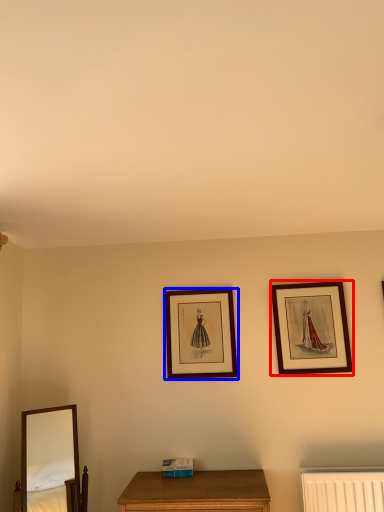
Question: Which point is closer to the camera, picture frame (highlighted by a red box) or picture frame (highlighted by a blue box)?

Choices:
 (A) picture frame
 (B) picture frame

Answer: (A)